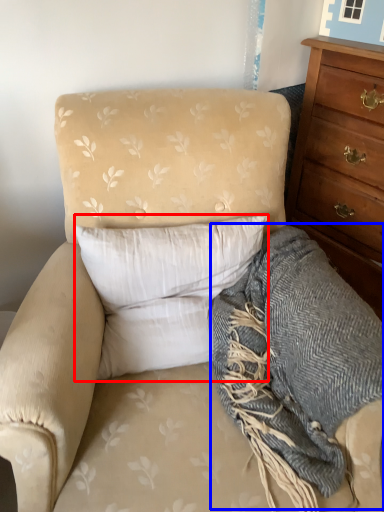
Question: Which object appears farthest to the camera in this image, pillow (highlighted by a red box) or blanket (highlighted by a blue box)?

Choices:
 (A) pillow
 (B) blanket

Answer: (A)